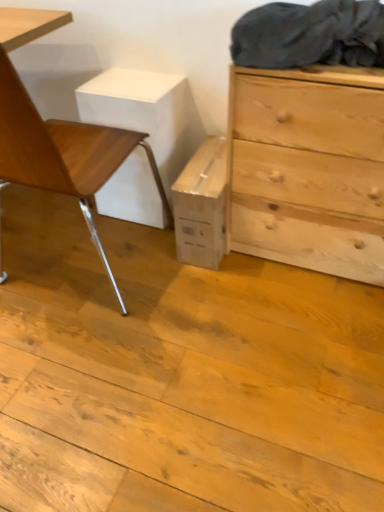
The height and width of the screenshot is (512, 384). In order to click on empty space that is to the right of wooden chair at left in this screenshot , I will do `click(203, 303)`.